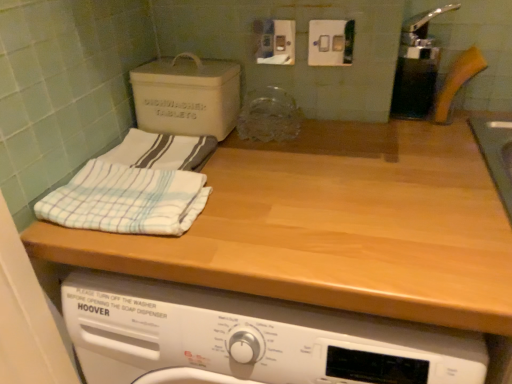
Image resolution: width=512 pixels, height=384 pixels. Identify the location of free point in front of matte gray cardboard box at upper left. (241, 158).